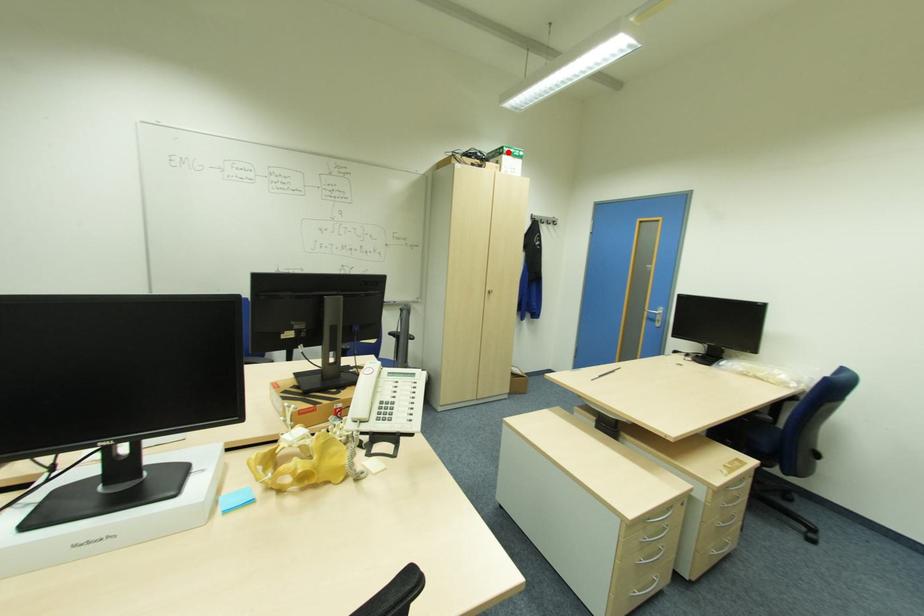
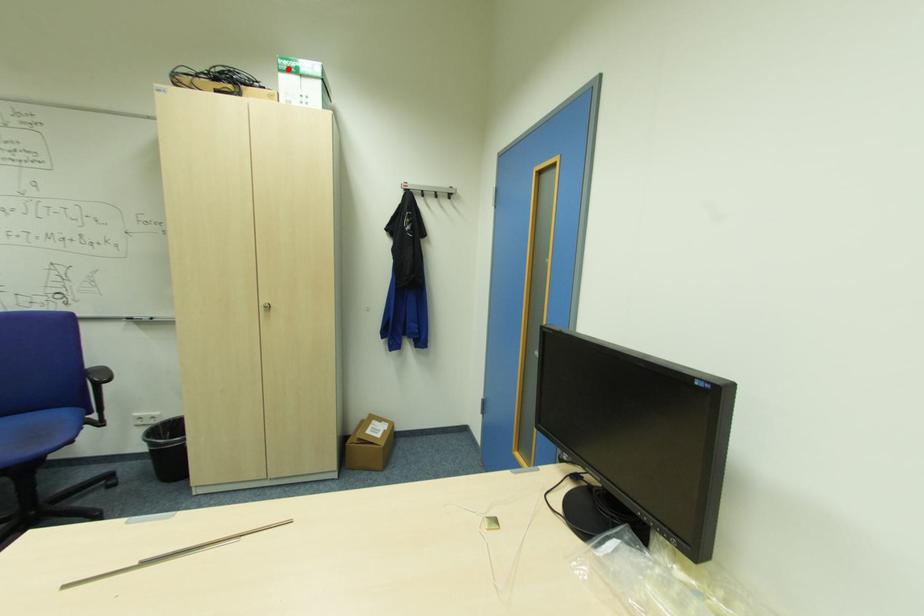
I am providing you with two images of the same scene from different viewpoints. A red point is marked on the first image and another point is marked on the second image. Do the highlighted points in image1 and image2 indicate the same real-world spot?

Yes